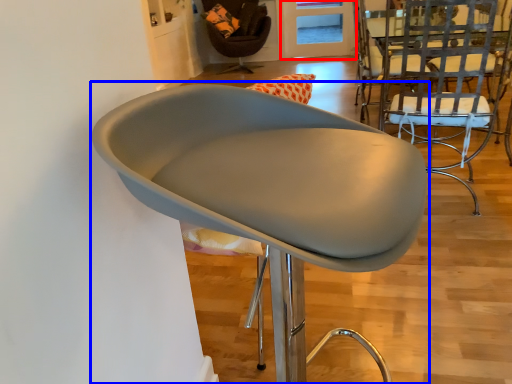
Question: Which object appears farthest to the camera in this image, glass door (highlighted by a red box) or chair (highlighted by a blue box)?

Choices:
 (A) glass door
 (B) chair

Answer: (A)